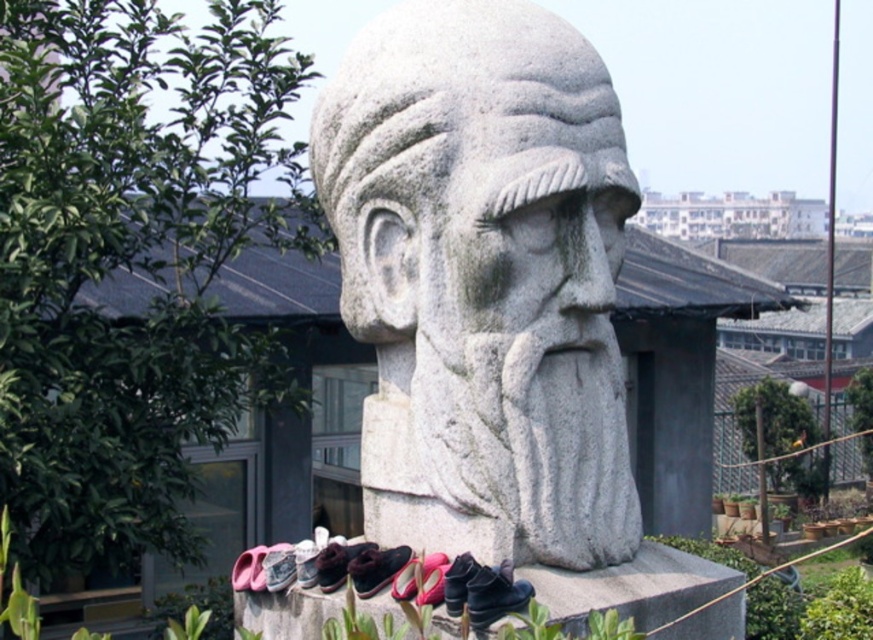
You are a visitor standing in front of the white stone bust at center and the black leather shoe at lower center. Which object is closer to you?

The white stone bust at center is closer to you than the black leather shoe at lower center because it is further away.

You are a tour guide leading a group near the sculpture. You notice two shoes, the brown leather shoe at lower center and the pink fabric shoe at lower center. A visitor asks if they can place their new pair of shoes next to these without overlapping them. The visitor has shoes that are 12 inches long. What should you advise?

The distance between the brown leather shoe at lower center and the pink fabric shoe at lower center is 17.51 inches. Since the visitor wants to place their shoes next to these without overlapping, and their shoes are 12 inches long, there is sufficient space between the existing shoes to accommodate the new pair.

You are a visitor standing in front of the white stone bust at center and the black leather shoe at lower center. Which object would you need to look up to see properly?

The white stone bust at center is larger in size than the black leather shoe at lower center, so you would need to look up to see the white stone bust at center properly.